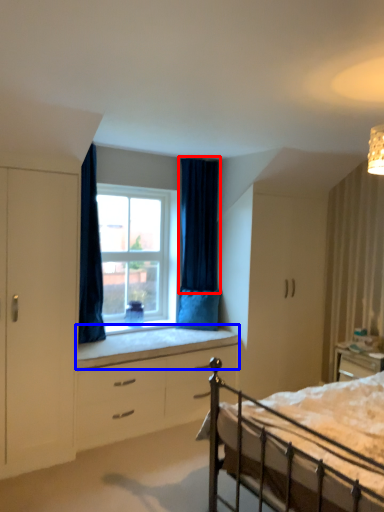
Question: Which of the following is the closest to the observer, curtain (highlighted by a red box) or window sill (highlighted by a blue box)?

Choices:
 (A) curtain
 (B) window sill

Answer: (B)